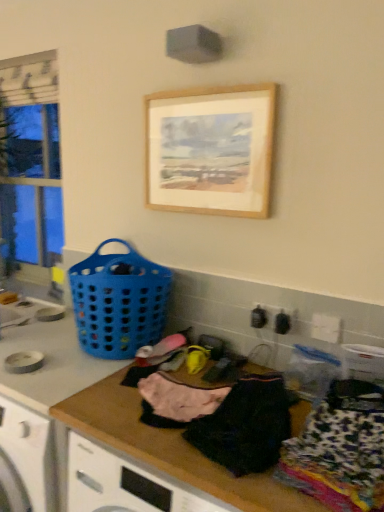
Question: Considering the positions of wooden at center and wooden picture frame at upper center in the image, is wooden at center bigger or smaller than wooden picture frame at upper center?

Choices:
 (A) small
 (B) big

Answer: (B)

Question: Is wooden at center inside or outside of wooden picture frame at upper center?

Choices:
 (A) inside
 (B) outside

Answer: (B)

Question: Which object is positioned closest to the wooden picture frame at upper center?

Choices:
 (A) pink fabric at center, the 1th clothing in the left-to-right sequence
 (B) black cotton shirt at center, which is counted as the second clothing, starting from the right
 (C) printed fabric clothing at lower right, marked as the 3th clothing in a left-to-right arrangement
 (D) wooden at center
 (E) clear glass window at left

Answer: (B)

Question: Based on their relative distances, which object is farther from the pink fabric at center, the 1th clothing in the left-to-right sequence?

Choices:
 (A) blue plastic basket at left
 (B) black cotton shirt at center, which is counted as the second clothing, starting from the right
 (C) wooden picture frame at upper center
 (D) printed fabric clothing at lower right, marked as the 1th clothing in a right-to-left arrangement
 (E) clear glass window at left

Answer: (E)